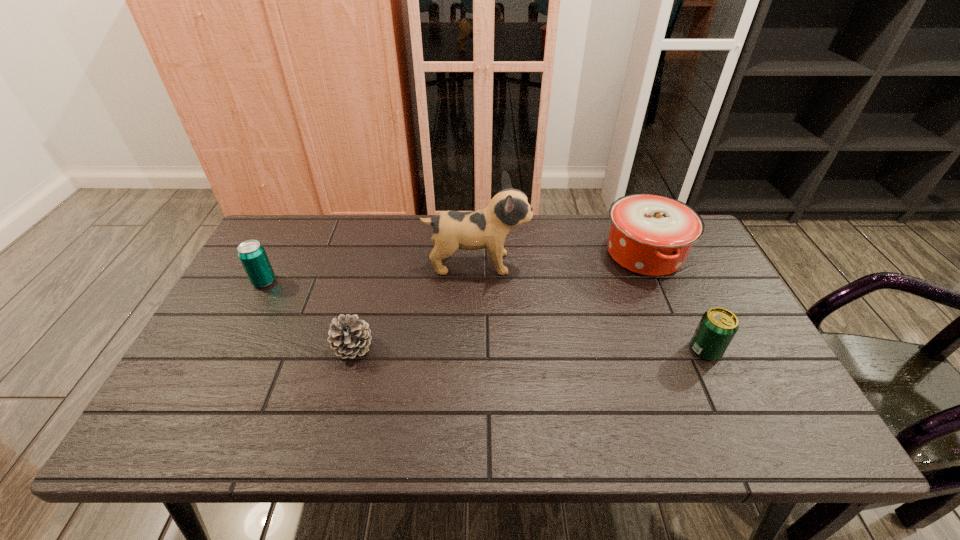
Where is `vacant area between the second tallest object and the right beer can`? This screenshot has height=540, width=960. vacant area between the second tallest object and the right beer can is located at coordinates (675, 302).

This screenshot has width=960, height=540. Identify the location of unoccupied position between the pinecone and the leftmost object. (308, 314).

The height and width of the screenshot is (540, 960). I want to click on object that can be found as the third closest to the pinecone, so click(650, 234).

Identify the location of object that stands as the third closest to the leftmost object. This screenshot has height=540, width=960. (650, 234).

This screenshot has height=540, width=960. In order to click on free space that satisfies the following two spatial constraints: 1. on the front side of the casserole; 2. at the face of the puppy in this screenshot , I will do `click(649, 264)`.

Locate an element on the screen. Image resolution: width=960 pixels, height=540 pixels. vacant space that satisfies the following two spatial constraints: 1. on the back side of the second object from left to right; 2. on the left side of the second tallest object is located at coordinates (377, 254).

At what (x,y) coordinates should I click in order to perform the action: click on vacant area in the image that satisfies the following two spatial constraints: 1. at the face of the nearer beer can; 2. on the right side of the third object from right to left. Please return your answer as a coordinate pair (x, y). Looking at the image, I should click on (476, 350).

Locate an element on the screen. The image size is (960, 540). vacant space that satisfies the following two spatial constraints: 1. at the face of the third object from right to left; 2. on the left side of the nearer beer can is located at coordinates (476, 350).